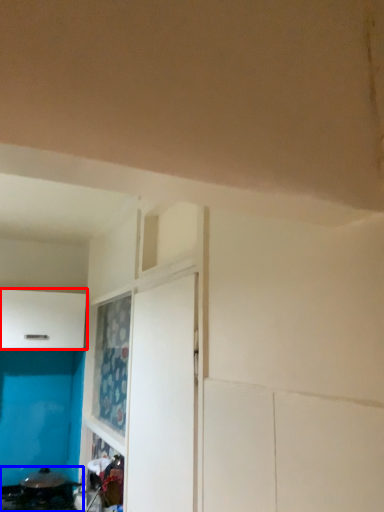
Question: Which point is closer to the camera, cabinetry (highlighted by a red box) or appliance (highlighted by a blue box)?

Choices:
 (A) cabinetry
 (B) appliance

Answer: (B)